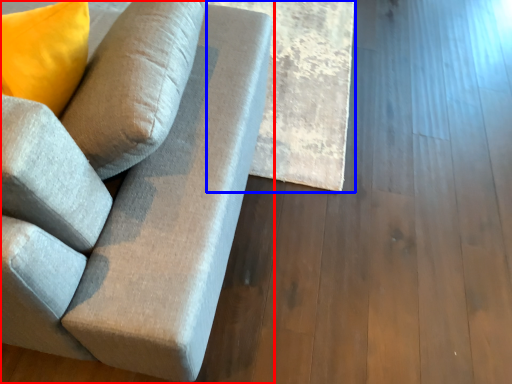
Question: Which of the following is the closest to the observer, studio couch (highlighted by a red box) or plank (highlighted by a blue box)?

Choices:
 (A) studio couch
 (B) plank

Answer: (A)